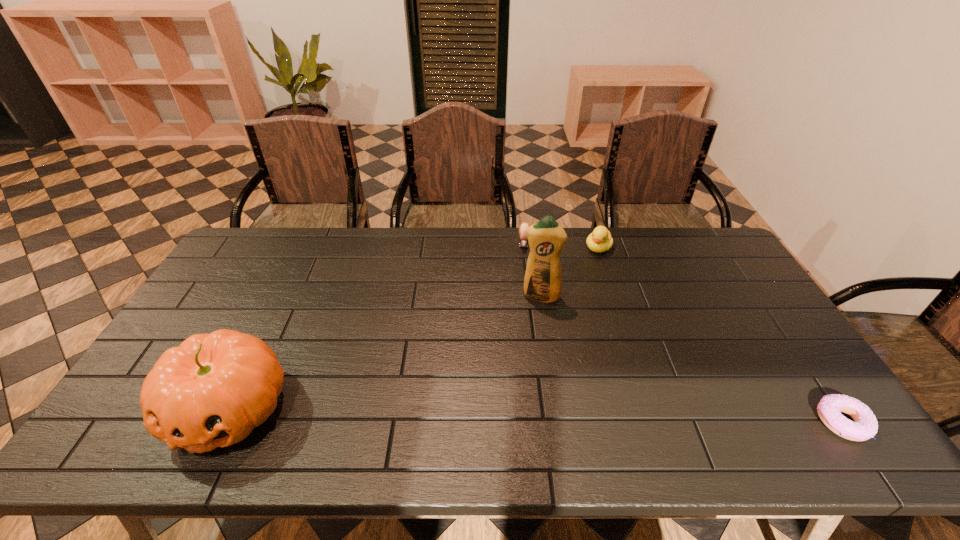
Where is `object that can be found as the closest to the duckling`? This screenshot has height=540, width=960. object that can be found as the closest to the duckling is located at coordinates (523, 242).

At what (x,y) coordinates should I click in order to perform the action: click on blank area in the image that satisfies the following two spatial constraints: 1. on the back side of the tallest object; 2. on the right side of the fourth object from left to right. Please return your answer as a coordinate pair (x, y). Looking at the image, I should click on (534, 248).